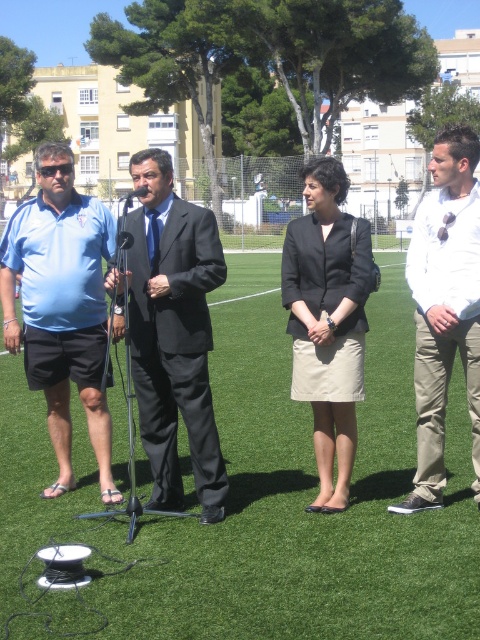
Can you confirm if dark gray blazer at center is positioned below black plastic microphone at center?

Indeed, dark gray blazer at center is positioned under black plastic microphone at center.

Between dark gray blazer at center and black plastic microphone at center, which one has less height?

With less height is dark gray blazer at center.

The height and width of the screenshot is (640, 480). I want to click on dark gray blazer at center, so click(x=327, y=321).

Locate an element on the screen. The width and height of the screenshot is (480, 640). dark gray blazer at center is located at coordinates 327,321.

Does black suit at center appear under dark gray blazer at center?

Indeed, black suit at center is positioned under dark gray blazer at center.

Is point (144, 156) behind point (360, 257)?

No, (144, 156) is closer to viewer.

Find the location of a particular element. black suit at center is located at coordinates (173, 333).

Between point (59, 616) and point (145, 188), which one is positioned behind?

The point (145, 188) is more distant.

Looking at this image, which of these two, green artificial turf at lower center or black plastic microphone at center, stands shorter?

green artificial turf at lower center

Does point (240, 540) come farther from viewer compared to point (136, 196)?

No, it is in front of (136, 196).

The height and width of the screenshot is (640, 480). Identify the location of green artificial turf at lower center. (267, 496).